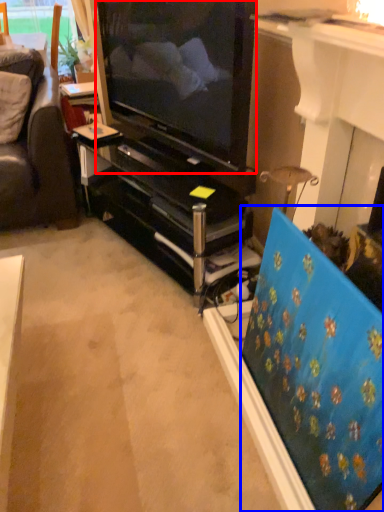
Question: Which point is further to the camera, television (highlighted by a red box) or flat (highlighted by a blue box)?

Choices:
 (A) television
 (B) flat

Answer: (A)